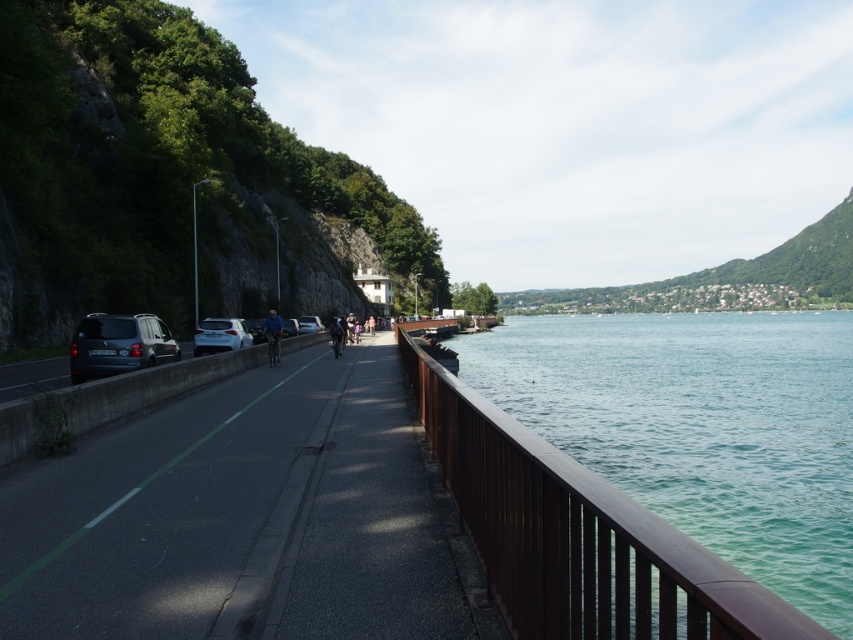
Question: Which point is closer to the camera?

Choices:
 (A) (271, 339)
 (B) (200, 324)
 (C) (341, 339)
 (D) (155, 321)

Answer: (D)

Question: Considering the relative positions of blue fabric jacket at center and matte black car at center in the image provided, where is blue fabric jacket at center located with respect to matte black car at center?

Choices:
 (A) above
 (B) below

Answer: (B)

Question: Does matte black van at left appear over blue fabric jacket at center?

Choices:
 (A) no
 (B) yes

Answer: (A)

Question: Considering the real-world distances, which object is farthest from the blue fabric jacket at center?

Choices:
 (A) shiny blue helmet at center
 (B) matte black car at center

Answer: (B)

Question: Where is blue fabric jacket at center located in relation to shiny blue helmet at center in the image?

Choices:
 (A) right
 (B) left

Answer: (B)

Question: Which object is the farthest from the white glossy car at center-left?

Choices:
 (A) green water at right
 (B) matte black van at left
 (C) shiny blue helmet at center
 (D) matte black car at center

Answer: (A)